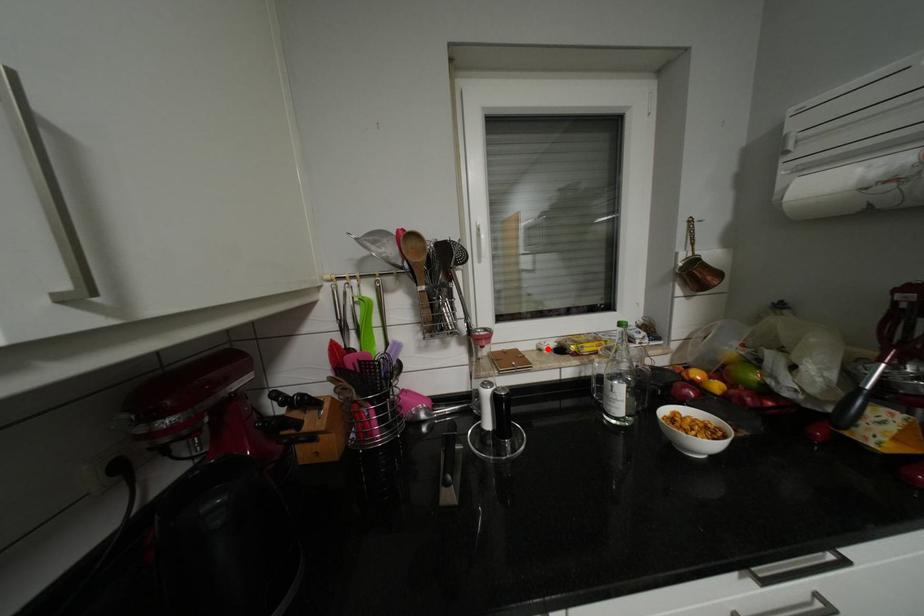
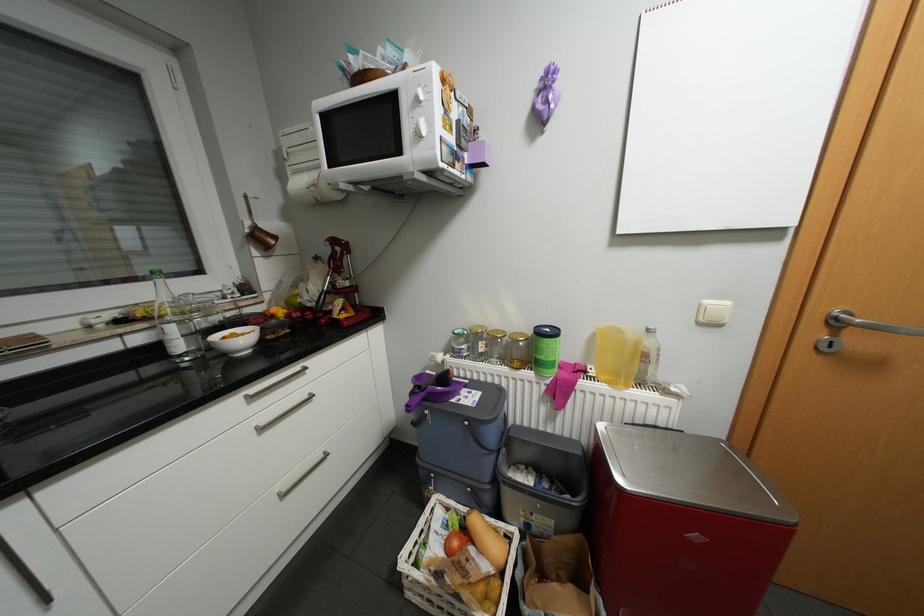
Where in the second image is the point corresponding to the highlighted location from the first image?

(96, 326)